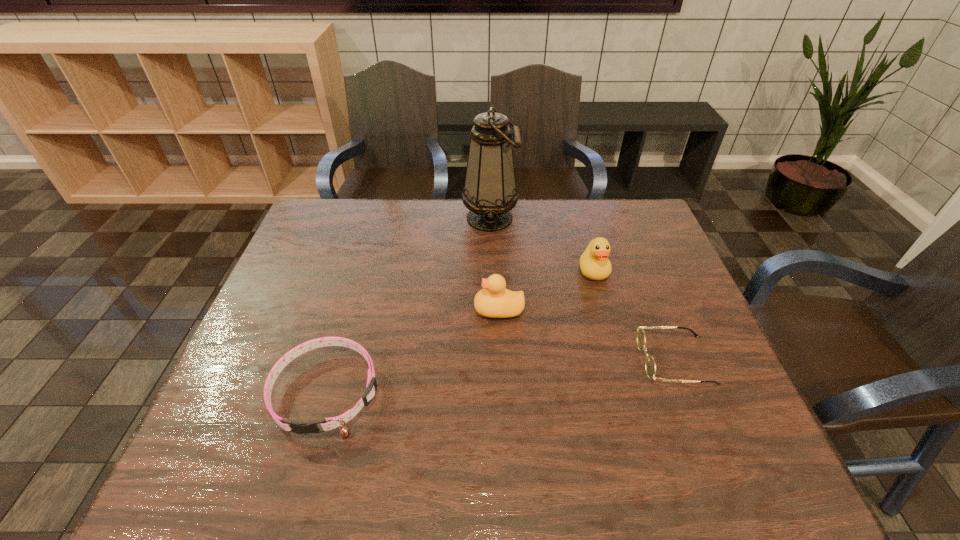
The image size is (960, 540). I want to click on vacant region that satisfies the following two spatial constraints: 1. on the lenses of the shortest object; 2. with the buckle on the leftmost object, so click(x=687, y=392).